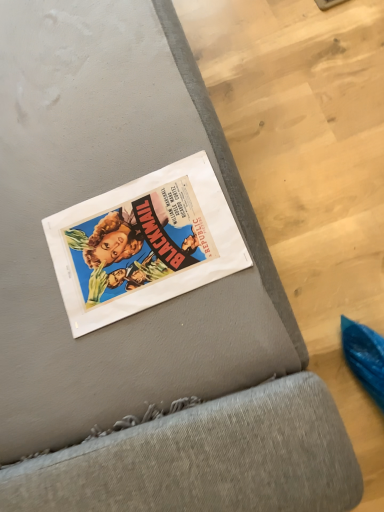
I want to click on matte paper poster at center, so click(x=143, y=244).

Image resolution: width=384 pixels, height=512 pixels. Describe the element at coordinates (143, 244) in the screenshot. I see `matte paper poster at center` at that location.

At what (x,y) coordinates should I click in order to perform the action: click on matte paper poster at center. Please return your answer as a coordinate pair (x, y). Looking at the image, I should click on (143, 244).